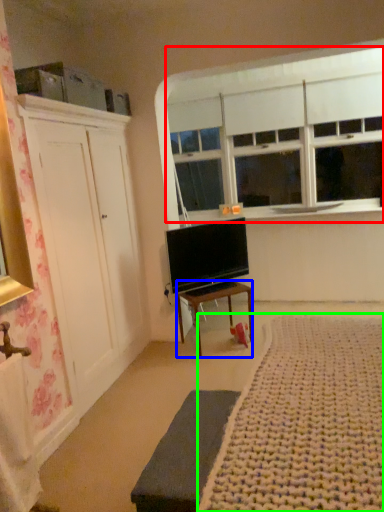
Question: Estimate the real-world distances between objects in this image. Which object is closer to window (highlighted by a red box), desk (highlighted by a blue box) or plain (highlighted by a green box)?

Choices:
 (A) desk
 (B) plain

Answer: (A)